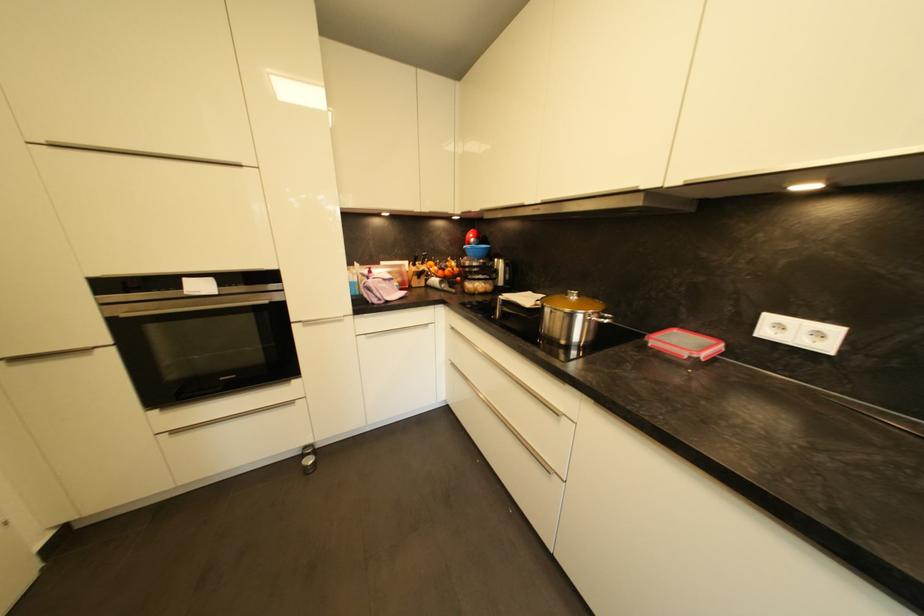
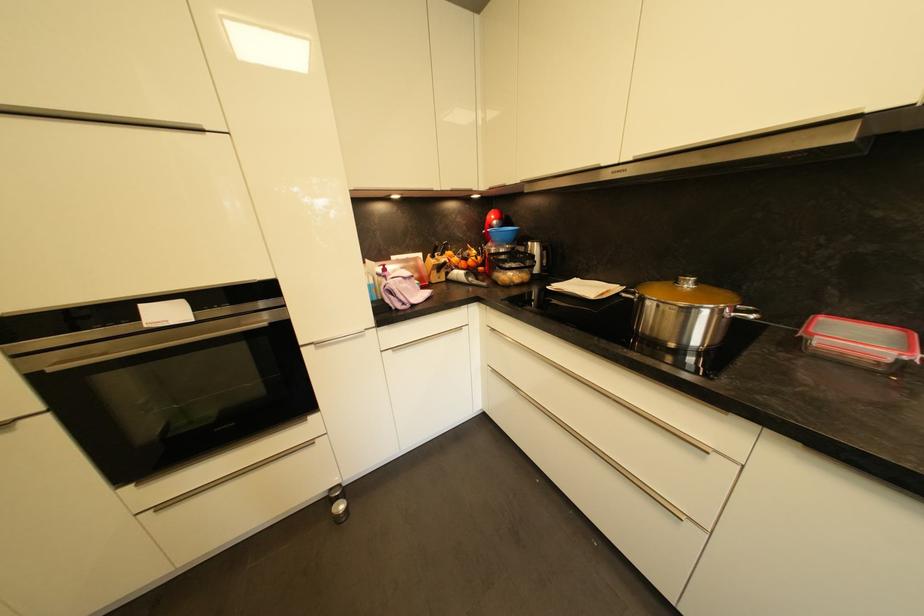
Locate, in the second image, the point that corresponds to [468,254] in the first image.

(492, 240)